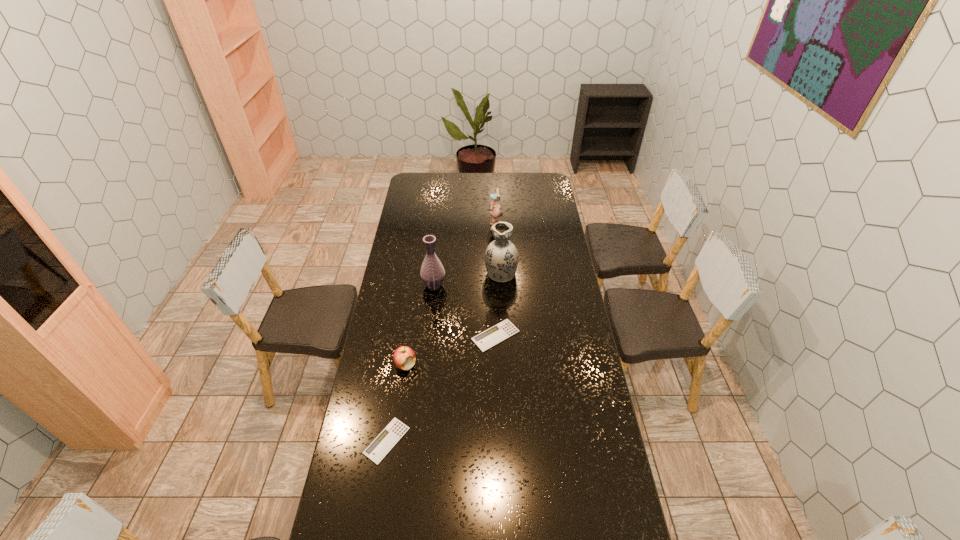
This screenshot has width=960, height=540. Find the location of `blank region between the figurine and the left vase`. blank region between the figurine and the left vase is located at coordinates (465, 256).

Find the location of `free space between the right vase and the shortest object`. free space between the right vase and the shortest object is located at coordinates (444, 356).

Where is `free space between the nearest object and the figurine`? free space between the nearest object and the figurine is located at coordinates (441, 334).

You are a GUI agent. You are given a task and a screenshot of the screen. Output one action in this format:
    pyautogui.click(x=<x>, y=<y>)
    Task: Click on the unoccupied position between the right vase and the left calculator
    This screenshot has width=960, height=540.
    Given the screenshot: What is the action you would take?
    click(x=444, y=356)

At what (x,y) coordinates should I click in order to perform the action: click on free spot between the shorter calculator and the right vase. Please return your answer as a coordinate pair (x, y). This screenshot has width=960, height=540. Looking at the image, I should click on (444, 356).

The height and width of the screenshot is (540, 960). I want to click on free space between the fourth tallest object and the figurine, so click(450, 296).

Identify which object is located as the fifth nearest to the farther calculator. Please provide its 2D coordinates. Your answer should be formatted as a tuple, i.e. [(x, y)], where the tuple contains the x and y coordinates of a point satisfying the conditions above.

[(495, 211)]

Select which object appears as the second closest to the left vase. Please provide its 2D coordinates. Your answer should be formatted as a tuple, i.e. [(x, y)], where the tuple contains the x and y coordinates of a point satisfying the conditions above.

[(485, 340)]

Find the location of `blank space that satisfies the following two spatial constraints: 1. on the front-facing side of the fourth shortest object; 2. with the handle on the side of the right vase`. blank space that satisfies the following two spatial constraints: 1. on the front-facing side of the fourth shortest object; 2. with the handle on the side of the right vase is located at coordinates pyautogui.click(x=497, y=272).

Locate an element on the screen. Image resolution: width=960 pixels, height=540 pixels. free location that satisfies the following two spatial constraints: 1. with the handle on the side of the right vase; 2. on the front-facing side of the fourth shortest object is located at coordinates (498, 227).